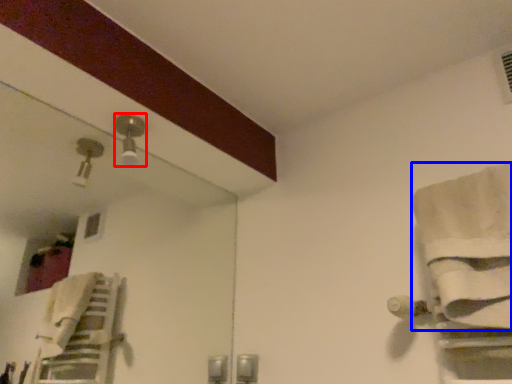
Question: Which object is closer to the camera taking this photo, light fixture (highlighted by a red box) or bath towel (highlighted by a blue box)?

Choices:
 (A) light fixture
 (B) bath towel

Answer: (B)